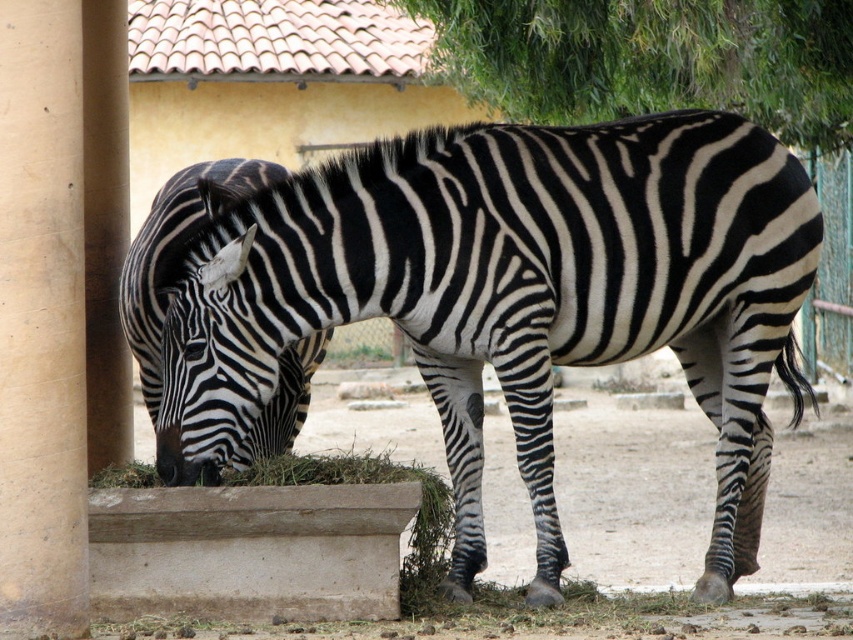
You are a zookeeper trying to determine the best spot to place a new feeding trough for the zebra. You have two points marked in the image at coordinates point (x=778, y=51) and point (x=167, y=218). Which point is closer to the zebra so that it can easily reach the food?

Point (x=778, y=51) is further to the viewer than point (x=167, y=218), so the zebra is closer to point (x=167, y=218). Therefore, placing the trough at point (x=167, y=218) would be better for the zebra to easily reach the food.

You are a zookeeper observing the black and white striped zebra at center and the green leafy tree at upper center. From the zebra, which direction would you look to see the tree?

The black and white striped zebra at center is positioned on the left side of green leafy tree at upper center, so to see the tree, you would look to the right from the zebra.

You are a visitor at the zoo and want to take a photo of the black and white striped zebra at lower left and the green leafy tree at upper center. Which object is closer to the camera?

The black and white striped zebra at lower left is closer to the camera because it is positioned lower in the frame, while the green leafy tree at upper center is higher up, indicating it might be farther away. However, according to the description, the green leafy tree at upper center is shorter than the zebra, so the zebra must be closer to the camera to appear larger despite its actual size.